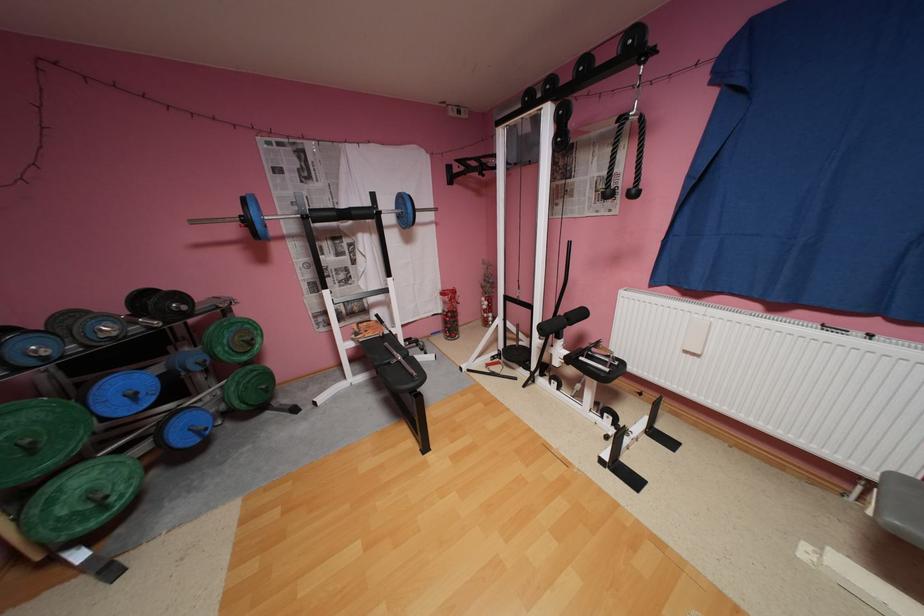
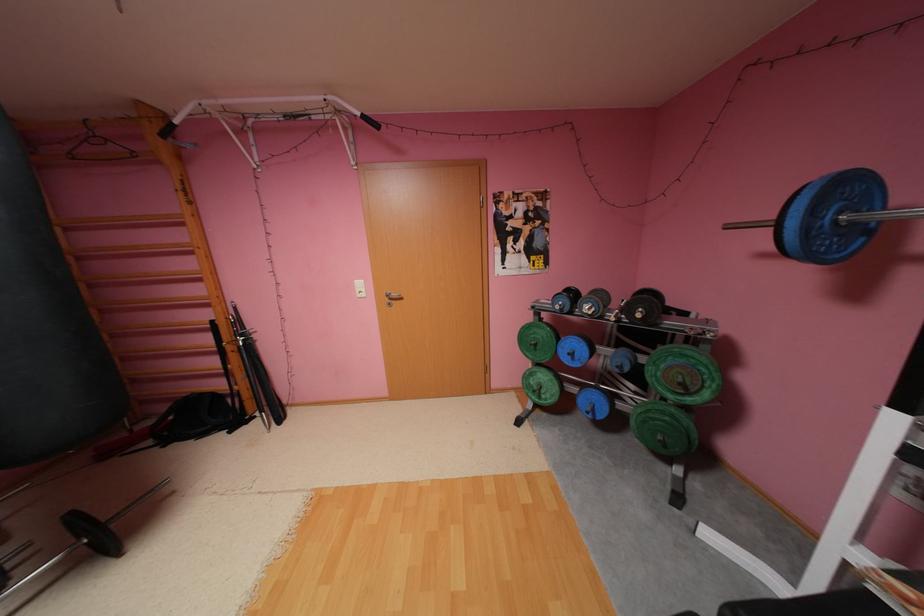
In the second image, find the point that corresponds to pixel 273 387 in the first image.

(669, 438)